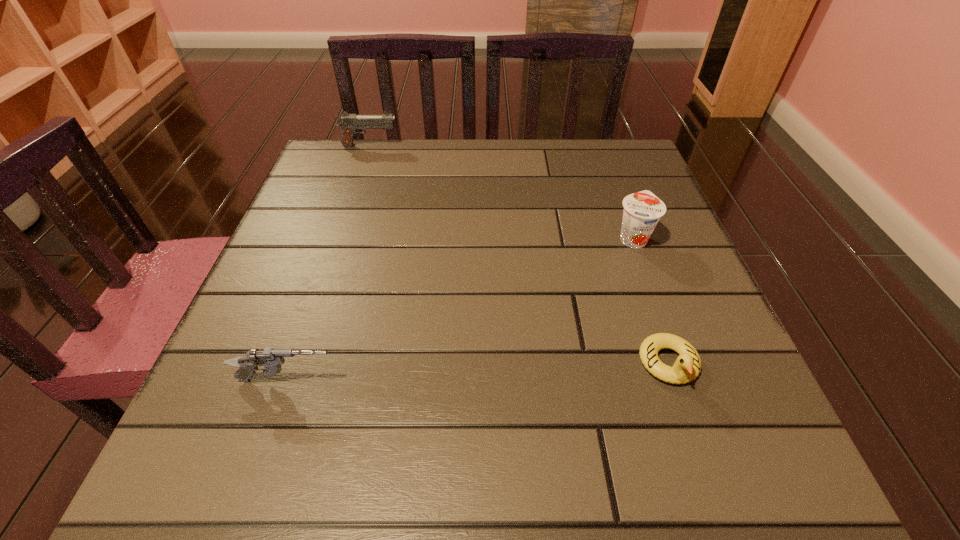
Select which object appears as the second closest to the third nearest object. Please provide its 2D coordinates. Your answer should be formatted as a tuple, i.e. [(x, y)], where the tuple contains the x and y coordinates of a point satisfying the conditions above.

[(271, 359)]

Image resolution: width=960 pixels, height=540 pixels. I want to click on vacant area in the image that satisfies the following two spatial constraints: 1. on the face of the duckling; 2. at the barrel of the shorter gun, so click(x=675, y=380).

Locate an element on the screen. The height and width of the screenshot is (540, 960). free region that satisfies the following two spatial constraints: 1. on the face of the duckling; 2. at the barrel of the shorter gun is located at coordinates (675, 380).

At what (x,y) coordinates should I click in order to perform the action: click on free space in the image that satisfies the following two spatial constraints: 1. on the face of the shortest object; 2. at the barrel of the shorter gun. Please return your answer as a coordinate pair (x, y). This screenshot has width=960, height=540. Looking at the image, I should click on (675, 380).

This screenshot has height=540, width=960. I want to click on free spot that satisfies the following two spatial constraints: 1. in the direction the farthest object is aimed; 2. on the back side of the yogurt, so click(x=339, y=238).

Identify the location of free space that satisfies the following two spatial constraints: 1. in the direction the third nearest object is aimed; 2. on the left side of the farther gun. (339, 238).